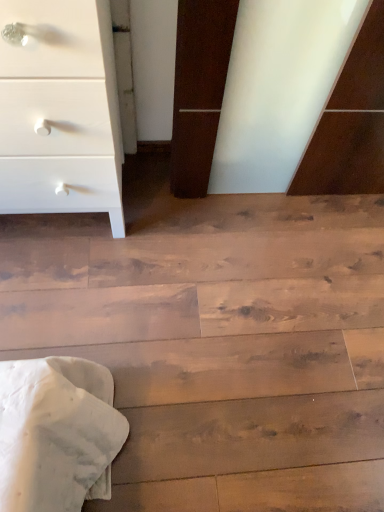
What do you see at coordinates (60, 111) in the screenshot?
I see `white matte chest of drawers at upper left` at bounding box center [60, 111].

Image resolution: width=384 pixels, height=512 pixels. In order to click on white matte chest of drawers at upper left in this screenshot , I will do `click(60, 111)`.

Measure the distance between point (97, 116) and camera.

A distance of 38.66 inches exists between point (97, 116) and camera.

You are a GUI agent. You are given a task and a screenshot of the screen. Output one action in this format:
    pyautogui.click(x=<x>, y=<y>)
    Task: Click on the wooden floor at lower center
    The width and height of the screenshot is (384, 512).
    Given the screenshot: What is the action you would take?
    pyautogui.click(x=218, y=342)

Describe the element at coordinates (218, 342) in the screenshot. I see `wooden floor at lower center` at that location.

Locate an element on the screen. The width and height of the screenshot is (384, 512). white matte chest of drawers at upper left is located at coordinates (60, 111).

Between wooden floor at lower center and white matte chest of drawers at upper left, which one appears on the left side from the viewer's perspective?

From the viewer's perspective, white matte chest of drawers at upper left appears more on the left side.

Does wooden floor at lower center lie behind white matte chest of drawers at upper left?

Yes, it is behind white matte chest of drawers at upper left.

Considering the positions of points (306, 476) and (2, 166), is point (306, 476) closer to camera compared to point (2, 166)?

No.

From the image's perspective, is wooden floor at lower center on white matte chest of drawers at upper left?

Incorrect, from the image's perspective, wooden floor at lower center is lower than white matte chest of drawers at upper left.

From a real-world perspective, is wooden floor at lower center physically above white matte chest of drawers at upper left?

No, from a real-world perspective, wooden floor at lower center is not over white matte chest of drawers at upper left

Does wooden floor at lower center have a greater width compared to white matte chest of drawers at upper left?

Yes.

From their relative heights in the image, would you say wooden floor at lower center is taller or shorter than white matte chest of drawers at upper left?

In the image, wooden floor at lower center appears to be shorter than white matte chest of drawers at upper left.

Can you confirm if wooden floor at lower center is bigger than white matte chest of drawers at upper left?

Actually, wooden floor at lower center might be smaller than white matte chest of drawers at upper left.

Is white matte chest of drawers at upper left surrounded by wooden floor at lower center?

No.

From the picture: Are wooden floor at lower center and white matte chest of drawers at upper left far apart?

That's not correct — wooden floor at lower center is a little close to white matte chest of drawers at upper left.

Is wooden floor at lower center turned away from white matte chest of drawers at upper left?

wooden floor at lower center is not turned away from white matte chest of drawers at upper left.

Can you tell me how much wooden floor at lower center and white matte chest of drawers at upper left differ in facing direction?

89.9 degrees.

Locate an element on the screen. The width and height of the screenshot is (384, 512). stairwell below the white matte chest of drawers at upper left (from the image's perspective) is located at coordinates (218, 342).

Which object is positioned more to the left, white matte chest of drawers at upper left or wooden floor at lower center?

white matte chest of drawers at upper left.

Considering their positions, is white matte chest of drawers at upper left located in front of or behind wooden floor at lower center?

Clearly, white matte chest of drawers at upper left is in front of wooden floor at lower center.

Which is nearer, (64,33) or (58,311)?

The point (64,33) is in front.

From the image's perspective, which is above, white matte chest of drawers at upper left or wooden floor at lower center?

white matte chest of drawers at upper left, from the image's perspective.

From a real-world perspective, which object rests below the other?

wooden floor at lower center is physically lower.

Which object is wider, white matte chest of drawers at upper left or wooden floor at lower center?

Wider between the two is wooden floor at lower center.

Considering the sizes of white matte chest of drawers at upper left and wooden floor at lower center in the image, is white matte chest of drawers at upper left taller or shorter than wooden floor at lower center?

Considering their sizes, white matte chest of drawers at upper left has more height than wooden floor at lower center.

Which of these two, white matte chest of drawers at upper left or wooden floor at lower center, is smaller?

wooden floor at lower center is smaller.

Is wooden floor at lower center a part of white matte chest of drawers at upper left?

No.

Is white matte chest of drawers at upper left next to wooden floor at lower center?

No, white matte chest of drawers at upper left is not making contact with wooden floor at lower center.

Is white matte chest of drawers at upper left facing away from wooden floor at lower center?

No, white matte chest of drawers at upper left is not facing the opposite direction of wooden floor at lower center.

This screenshot has height=512, width=384. Find the location of `stairwell below the white matte chest of drawers at upper left (from the image's perspective)`. stairwell below the white matte chest of drawers at upper left (from the image's perspective) is located at coordinates (218, 342).

In the image, there is a wooden floor at lower center. At what (x,y) coordinates should I click in order to perform the action: click on the chest of drawers above it (from the image's perspective). Please return your answer as a coordinate pair (x, y). The height and width of the screenshot is (512, 384). Looking at the image, I should click on (60, 111).

Locate an element on the screen. stairwell to the right of white matte chest of drawers at upper left is located at coordinates (218, 342).